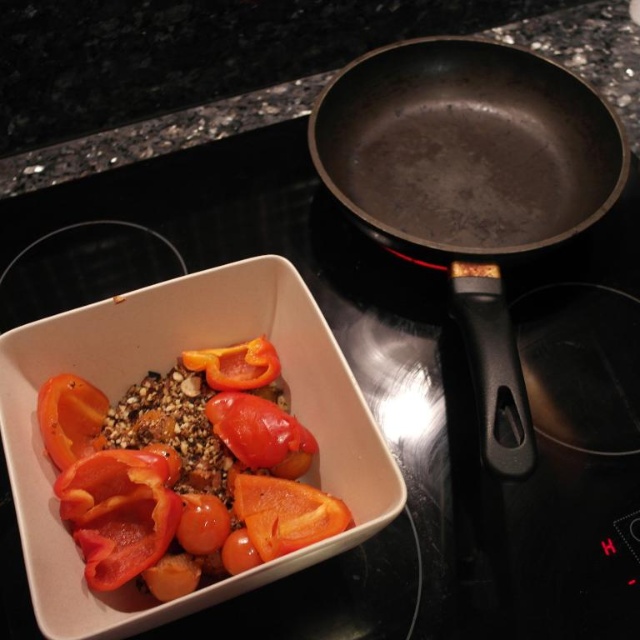
Question: Can you confirm if slightly translucent orange bell pepper at center is smaller than glossy orange tomato at center?

Choices:
 (A) yes
 (B) no

Answer: (B)

Question: Which object appears farthest from the camera in this image?

Choices:
 (A) glossy orange tomato at center
 (B) sliced matte orange tomato at lower left

Answer: (B)

Question: Which point is farther to the camera?

Choices:
 (A) glossy orange tomato at center
 (B) matte black wok at right

Answer: (B)

Question: Does glossy red tomato at center appear on the left side of glossy orange tomato at center?

Choices:
 (A) no
 (B) yes

Answer: (A)

Question: Which object appears closest to the camera in this image?

Choices:
 (A) slightly translucent orange bell pepper at center
 (B) glossy orange tomato at center
 (C) sliced matte orange tomato at lower left

Answer: (A)

Question: Considering the relative positions of glossy red tomato at center and glossy orange tomato at center in the image provided, where is glossy red tomato at center located with respect to glossy orange tomato at center?

Choices:
 (A) left
 (B) right

Answer: (B)